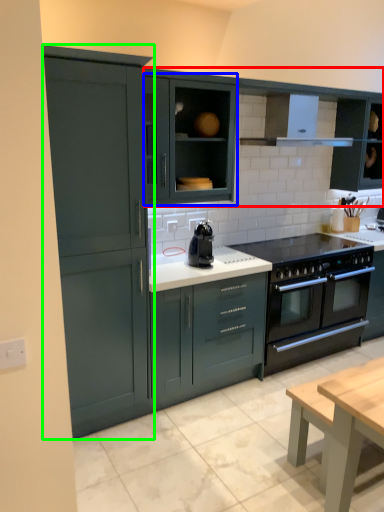
Question: Which object is positioned closest to cabinetry (highlighted by a red box)? Select from cabinetry (highlighted by a blue box) and cabinetry (highlighted by a green box).

Choices:
 (A) cabinetry
 (B) cabinetry

Answer: (A)